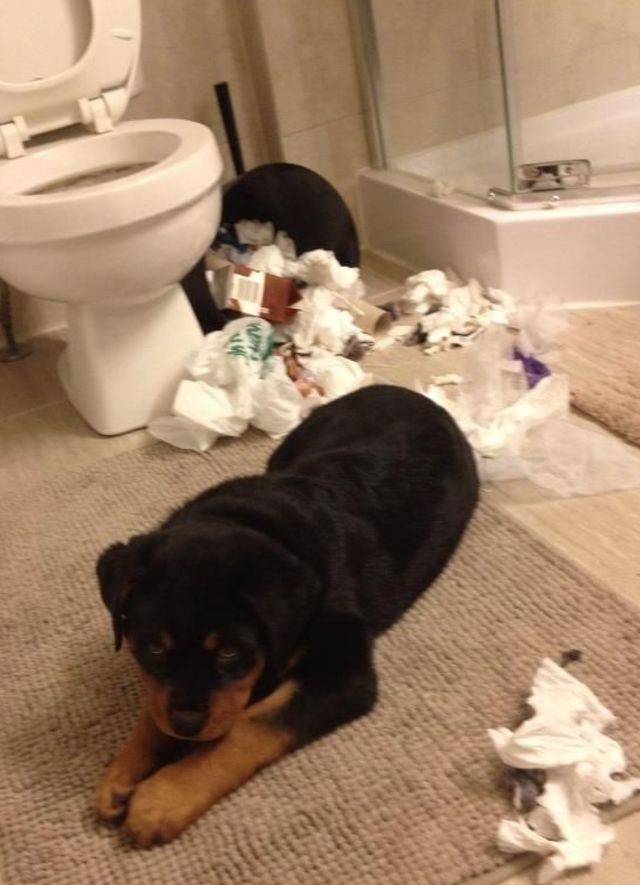
Where is `tissue`? tissue is located at coordinates (577, 816), (561, 714), (497, 431), (337, 327), (324, 267).